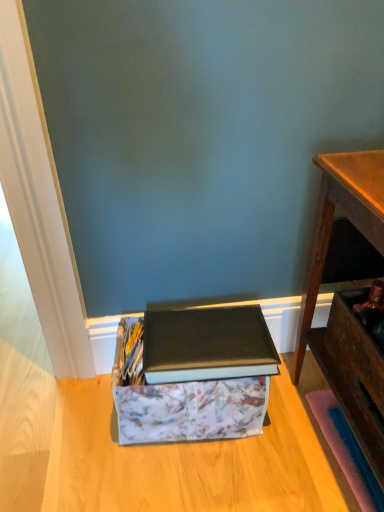
Question: Can you confirm if wooden desk at right is wider than matte black book at center?

Choices:
 (A) yes
 (B) no

Answer: (A)

Question: Is wooden desk at right oriented towards matte black book at center?

Choices:
 (A) yes
 (B) no

Answer: (A)

Question: Does wooden desk at right have a lesser height compared to matte black book at center?

Choices:
 (A) yes
 (B) no

Answer: (B)

Question: Is wooden desk at right next to matte black book at center and touching it?

Choices:
 (A) yes
 (B) no

Answer: (B)

Question: Is wooden desk at right not inside matte black book at center?

Choices:
 (A) no
 (B) yes

Answer: (B)

Question: Are wooden desk at right and matte black book at center far apart?

Choices:
 (A) yes
 (B) no

Answer: (B)

Question: Could you tell me if matte black book at center is turned towards wooden drawer at lower right?

Choices:
 (A) no
 (B) yes

Answer: (A)

Question: Can you confirm if matte black book at center is wider than wooden drawer at lower right?

Choices:
 (A) yes
 (B) no

Answer: (A)

Question: Is matte black book at center shorter than wooden drawer at lower right?

Choices:
 (A) yes
 (B) no

Answer: (A)

Question: From the image's perspective, would you say matte black book at center is shown under wooden drawer at lower right?

Choices:
 (A) yes
 (B) no

Answer: (A)

Question: Is matte black book at center not inside wooden drawer at lower right?

Choices:
 (A) yes
 (B) no

Answer: (A)

Question: Does matte black book at center lie in front of wooden drawer at lower right?

Choices:
 (A) yes
 (B) no

Answer: (B)

Question: Can you confirm if wooden drawer at lower right is thinner than floral fabric storage box at lower center?

Choices:
 (A) no
 (B) yes

Answer: (B)